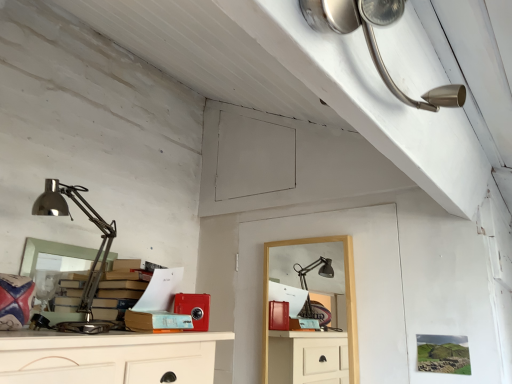
Question: Is the position of satin nickel lamp at upper right, the 1th lamp when ordered from right to left, more distant than that of polished metal desk lamp at left, which is the first lamp from bottom to top?

Choices:
 (A) yes
 (B) no

Answer: (B)

Question: Does satin nickel lamp at upper right, arranged as the 1th lamp when viewed from the front, touch polished metal desk lamp at left, marked as the second lamp in a right-to-left arrangement?

Choices:
 (A) yes
 (B) no

Answer: (B)

Question: Considering the relative positions of satin nickel lamp at upper right, the 2th lamp viewed from the left, and polished metal desk lamp at left, marked as the first lamp in a back-to-front arrangement, in the image provided, is satin nickel lamp at upper right, the 2th lamp viewed from the left, to the right of polished metal desk lamp at left, marked as the first lamp in a back-to-front arrangement, from the viewer's perspective?

Choices:
 (A) no
 (B) yes

Answer: (B)

Question: Is satin nickel lamp at upper right, the 2th lamp when ordered from back to front, closer to the viewer compared to polished metal desk lamp at left, which is the first lamp from bottom to top?

Choices:
 (A) yes
 (B) no

Answer: (A)

Question: Does satin nickel lamp at upper right, the 1th lamp when ordered from right to left, have a lesser height compared to polished metal desk lamp at left, which is the 2th lamp from top to bottom?

Choices:
 (A) yes
 (B) no

Answer: (A)

Question: Is satin nickel lamp at upper right, the 2th lamp viewed from the left, facing away from polished metal desk lamp at left, which ranks as the 1th lamp in left-to-right order?

Choices:
 (A) no
 (B) yes

Answer: (A)

Question: Considering the relative sizes of polished metal desk lamp at left, which is the 2th lamp from top to bottom, and wooden desk at center in the image provided, is polished metal desk lamp at left, which is the 2th lamp from top to bottom, wider than wooden desk at center?

Choices:
 (A) yes
 (B) no

Answer: (A)

Question: Considering the relative sizes of polished metal desk lamp at left, which ranks as the 1th lamp in left-to-right order, and wooden desk at center in the image provided, is polished metal desk lamp at left, which ranks as the 1th lamp in left-to-right order, smaller than wooden desk at center?

Choices:
 (A) yes
 (B) no

Answer: (B)

Question: Is the position of polished metal desk lamp at left, which ranks as the 1th lamp in left-to-right order, more distant than that of wooden desk at center?

Choices:
 (A) no
 (B) yes

Answer: (A)

Question: From a real-world perspective, is polished metal desk lamp at left, which is the first lamp from bottom to top, below wooden desk at center?

Choices:
 (A) yes
 (B) no

Answer: (B)

Question: Can you see polished metal desk lamp at left, which is the first lamp from bottom to top, touching wooden desk at center?

Choices:
 (A) no
 (B) yes

Answer: (A)

Question: From the image's perspective, is polished metal desk lamp at left, which is the 2th lamp from top to bottom, located above wooden desk at center?

Choices:
 (A) no
 (B) yes

Answer: (B)

Question: Can you confirm if polished metal desk lamp at left, which ranks as the 1th lamp in left-to-right order, is bigger than satin nickel lamp at upper right, the 1th lamp when ordered from right to left?

Choices:
 (A) yes
 (B) no

Answer: (A)